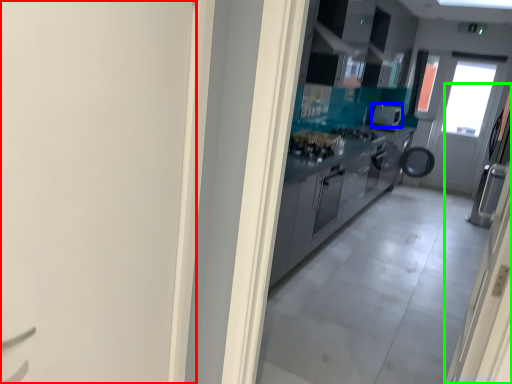
Question: Which object is the closest to the door (highlighted by a red box)? Choose among these: appliance (highlighted by a blue box) or door (highlighted by a green box).

Choices:
 (A) appliance
 (B) door

Answer: (B)